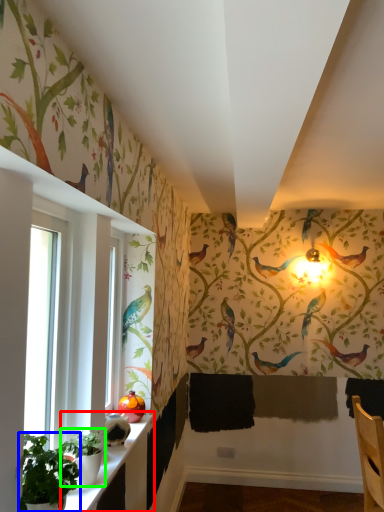
Question: Which object is the farthest from window sill (highlighted by a red box)? Choose among these: plant (highlighted by a blue box) or plant (highlighted by a green box).

Choices:
 (A) plant
 (B) plant

Answer: (A)